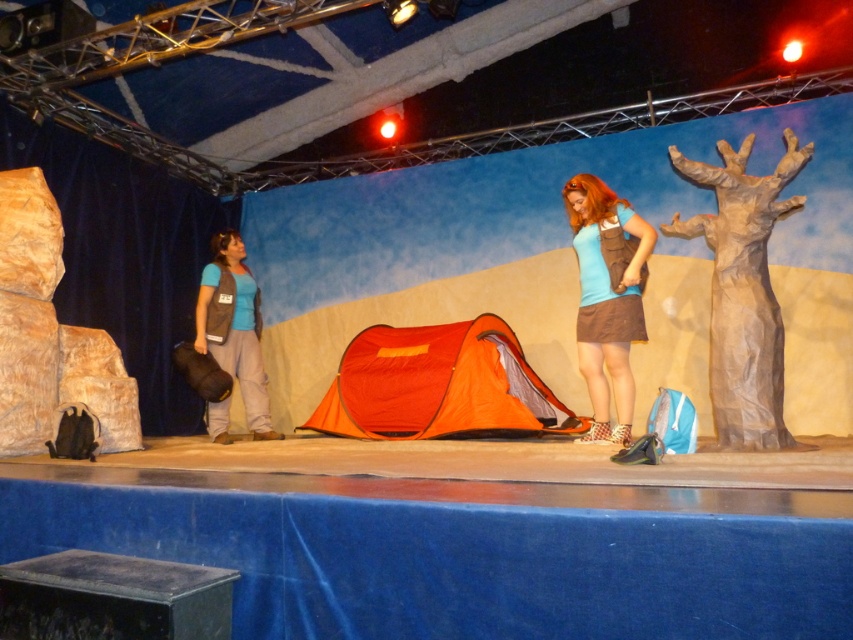
Does matte brown backpack at center have a lesser width compared to matte gray vest at left?

Correct, matte brown backpack at center's width is less than matte gray vest at left's.

Between point (605, 401) and point (254, 312), which one is positioned in front?

Point (605, 401) is more forward.

Image resolution: width=853 pixels, height=640 pixels. What do you see at coordinates (606, 301) in the screenshot?
I see `matte brown backpack at center` at bounding box center [606, 301].

You are a GUI agent. You are given a task and a screenshot of the screen. Output one action in this format:
    pyautogui.click(x=<x>, y=<y>)
    Task: Click on the matte brown backpack at center
    
    Given the screenshot: What is the action you would take?
    pyautogui.click(x=606, y=301)

Is orange pop-up tent at center bigger than matte brown backpack at center?

Yes, orange pop-up tent at center is bigger than matte brown backpack at center.

Can you confirm if orange pop-up tent at center is wider than matte brown backpack at center?

Correct, the width of orange pop-up tent at center exceeds that of matte brown backpack at center.

Does point (335, 404) lie behind point (576, 186)?

Yes, it is.

Image resolution: width=853 pixels, height=640 pixels. In order to click on orange pop-up tent at center in this screenshot , I will do `click(439, 385)`.

Does point (399, 387) come closer to viewer compared to point (267, 408)?

Yes.

Who is shorter, orange pop-up tent at center or matte gray vest at left?

Standing shorter between the two is orange pop-up tent at center.

Image resolution: width=853 pixels, height=640 pixels. What are the coordinates of `orange pop-up tent at center` in the screenshot? It's located at (439, 385).

Identify the location of orange pop-up tent at center. The width and height of the screenshot is (853, 640). (439, 385).